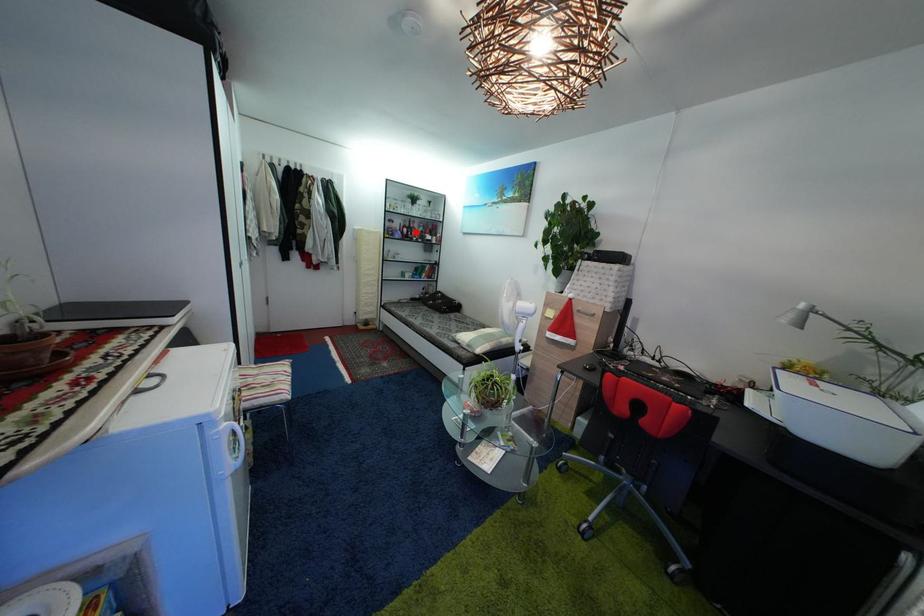
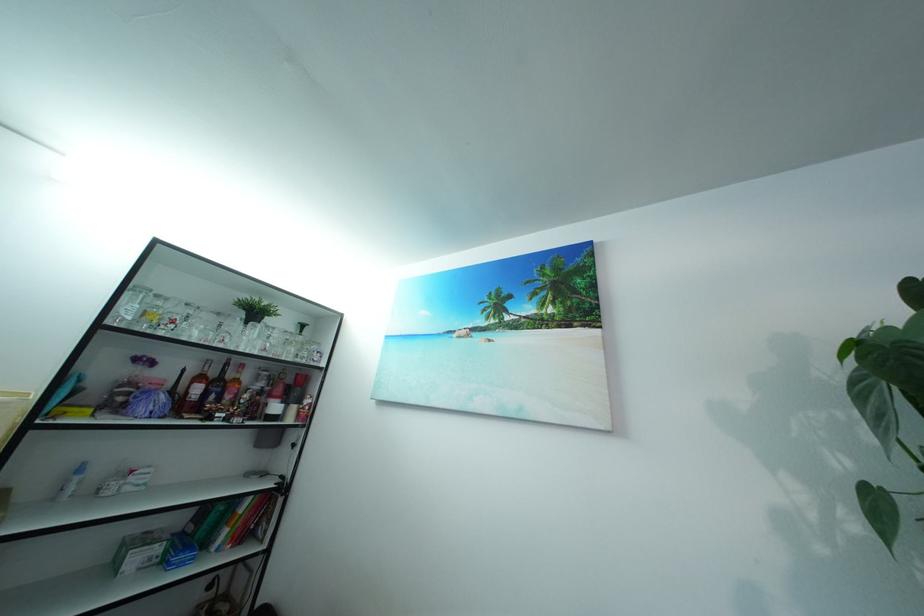
In the second image, find the point that corresponds to the highlighted location in the first image.

(222, 381)